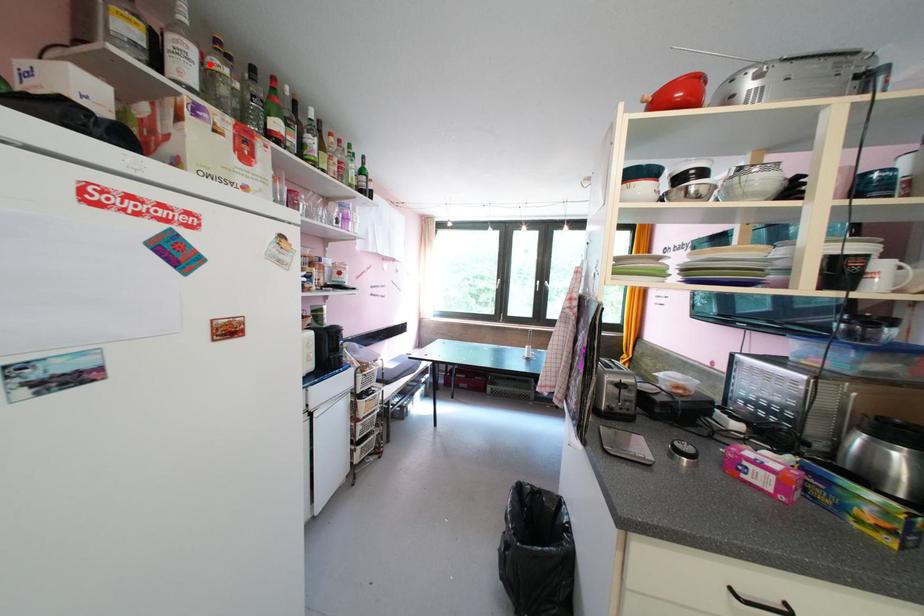
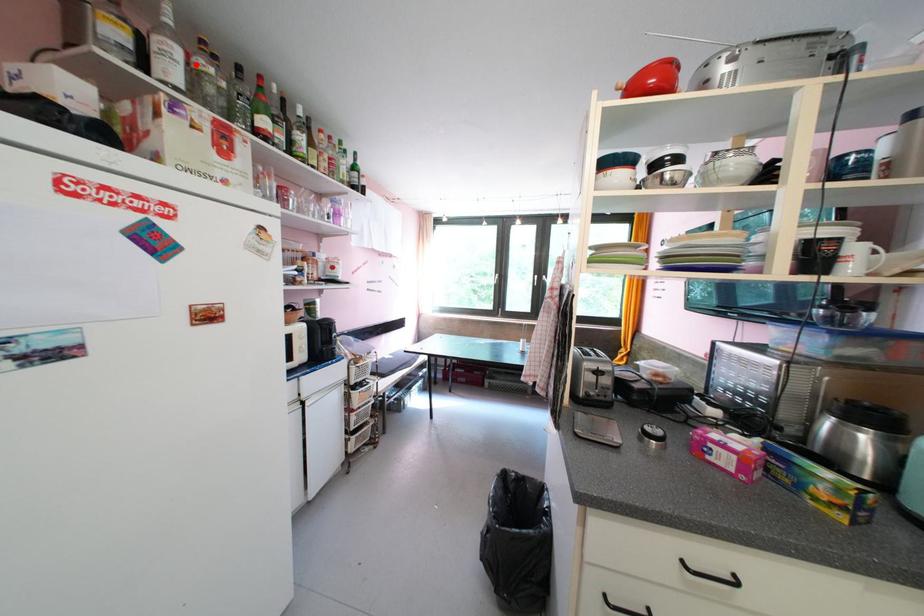
I am providing you with two images of the same scene from different viewpoints. A red point is marked on the first image and another point is marked on the second image. Do the highlighted points in image1 and image2 indicate the same real-world spot?

Yes